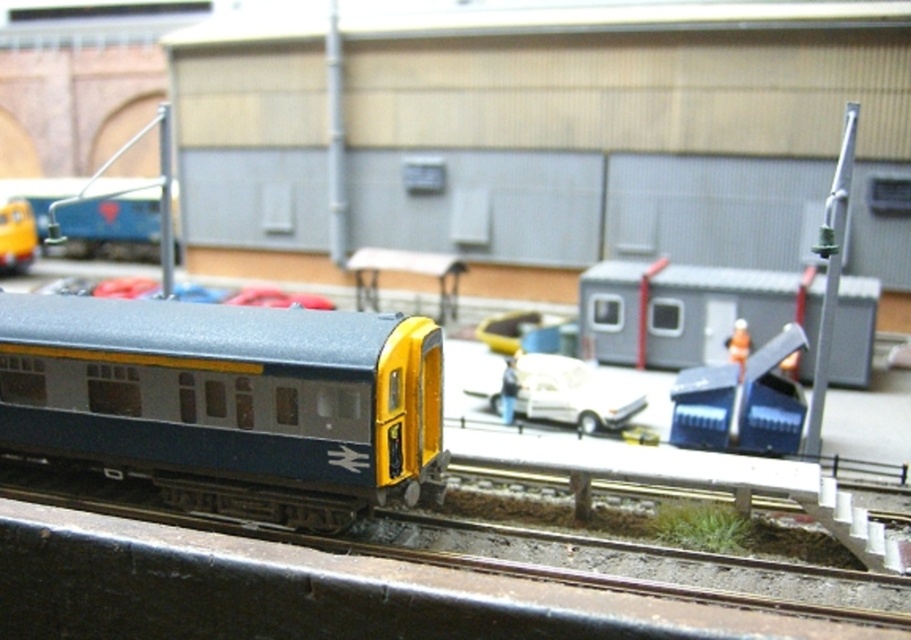
Which is more to the left, metallic blue train at center or white matte car at center?

metallic blue train at center

Is metallic blue train at center bigger than white matte car at center?

Indeed, metallic blue train at center has a larger size compared to white matte car at center.

Does point (41, 300) come in front of point (623, 400)?

Yes, point (41, 300) is in front of point (623, 400).

What are the coordinates of `metallic blue train at center` in the screenshot? It's located at (227, 401).